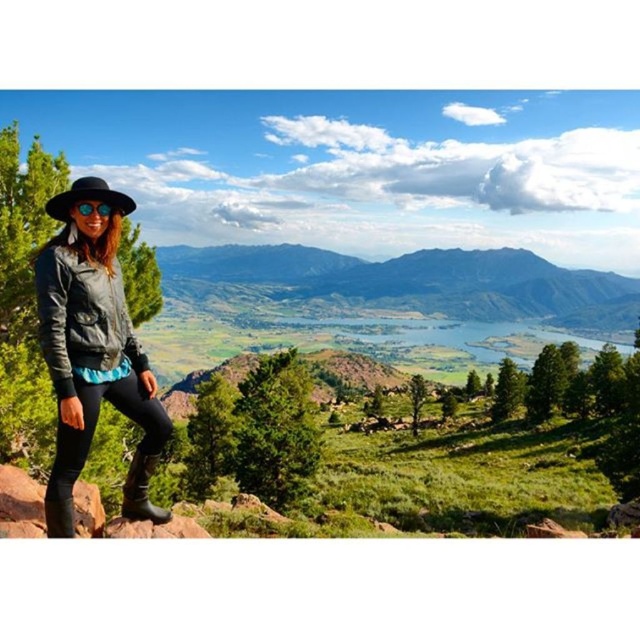
Question: Is green grassy mountain at center positioned at the back of matte black jacket at left?

Choices:
 (A) yes
 (B) no

Answer: (A)

Question: Which of the following is the closest to the observer?

Choices:
 (A) matte black jacket at left
 (B) green grassy mountain at center
 (C) sunglasses at left

Answer: (A)

Question: Can you confirm if green grassy mountain at center is positioned to the left of sunglasses at left?

Choices:
 (A) no
 (B) yes

Answer: (A)

Question: Can you confirm if green grassy mountain at center is wider than matte black jacket at left?

Choices:
 (A) no
 (B) yes

Answer: (B)

Question: Which of the following is the closest to the observer?

Choices:
 (A) sunglasses at left
 (B) green grassy mountain at center
 (C) matte black jacket at left

Answer: (C)

Question: Which of the following is the closest to the observer?

Choices:
 (A) (72, 321)
 (B) (100, 204)

Answer: (A)